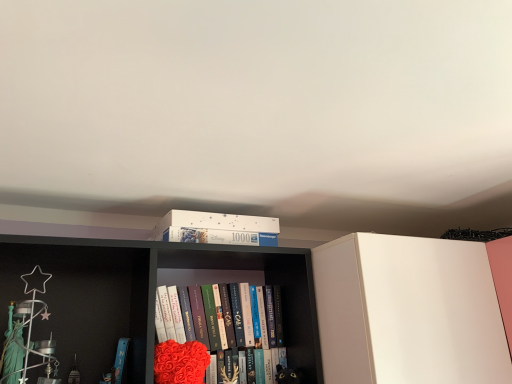
Question: Is white matte puzzle box at upper center not inside velvety red heart at center?

Choices:
 (A) yes
 (B) no

Answer: (A)

Question: Can you confirm if white matte puzzle box at upper center is smaller than velvety red heart at center?

Choices:
 (A) yes
 (B) no

Answer: (B)

Question: Considering the relative positions of white matte puzzle box at upper center and velvety red heart at center in the image provided, is white matte puzzle box at upper center to the left of velvety red heart at center from the viewer's perspective?

Choices:
 (A) no
 (B) yes

Answer: (B)

Question: Considering the relative sizes of white matte puzzle box at upper center and velvety red heart at center in the image provided, is white matte puzzle box at upper center shorter than velvety red heart at center?

Choices:
 (A) no
 (B) yes

Answer: (A)

Question: Would you say white matte puzzle box at upper center contains velvety red heart at center?

Choices:
 (A) no
 (B) yes

Answer: (B)

Question: From a real-world perspective, is velvety red heart at center above or below white cardboard puzzle box at upper center?

Choices:
 (A) above
 (B) below

Answer: (B)

Question: Is point (159, 360) closer or farther from the camera than point (239, 243)?

Choices:
 (A) closer
 (B) farther

Answer: (A)

Question: In terms of height, does velvety red heart at center look taller or shorter compared to white cardboard puzzle box at upper center?

Choices:
 (A) short
 (B) tall

Answer: (B)

Question: Based on their positions, is velvety red heart at center located to the left or right of white cardboard puzzle box at upper center?

Choices:
 (A) left
 (B) right

Answer: (A)

Question: Is hardcover book at center to the left or to the right of velvety red heart at center in the image?

Choices:
 (A) right
 (B) left

Answer: (A)

Question: From their relative heights in the image, would you say hardcover book at center is taller or shorter than velvety red heart at center?

Choices:
 (A) tall
 (B) short

Answer: (A)

Question: Based on their sizes in the image, would you say hardcover book at center is bigger or smaller than velvety red heart at center?

Choices:
 (A) big
 (B) small

Answer: (A)

Question: Which is correct: hardcover book at center is inside velvety red heart at center, or outside of it?

Choices:
 (A) inside
 (B) outside

Answer: (B)

Question: In terms of width, does velvety red heart at center look wider or thinner when compared to white matte puzzle box at upper center?

Choices:
 (A) thin
 (B) wide

Answer: (A)

Question: Is velvety red heart at center bigger or smaller than white matte puzzle box at upper center?

Choices:
 (A) big
 (B) small

Answer: (B)